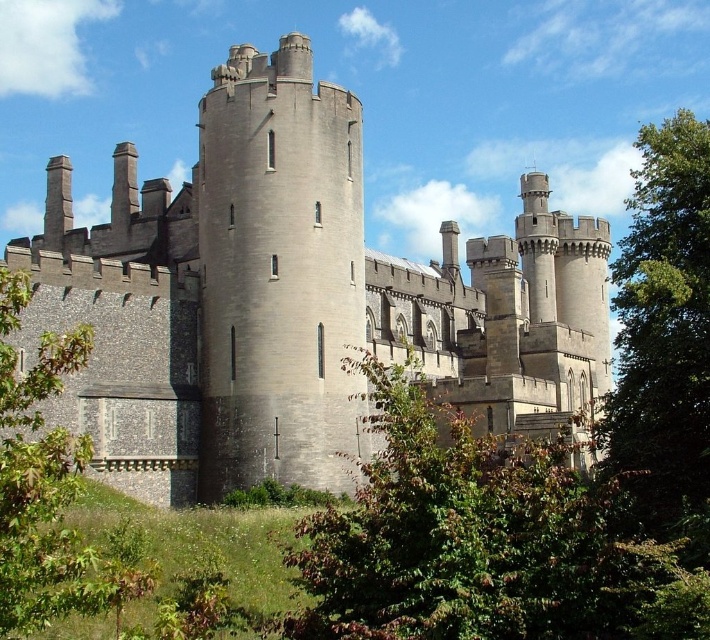
Between gray stone tower at center and green leafy tree at right, which one has more height?

With more height is green leafy tree at right.

Who is lower down, gray stone tower at center or green leafy tree at right?

Positioned lower is gray stone tower at center.

Is point (278, 99) behind point (662, 227)?

Yes, it is.

At what (x,y) coordinates should I click in order to perform the action: click on gray stone tower at center. Please return your answer as a coordinate pair (x, y). Image resolution: width=710 pixels, height=640 pixels. Looking at the image, I should click on (278, 272).

Which is below, gray stone castle at center or gray stone tower at center?

gray stone castle at center is lower down.

Which is more to the right, gray stone castle at center or gray stone tower at center?

gray stone castle at center is more to the right.

Does point (244, 291) come behind point (263, 260)?

No, it is in front of (263, 260).

I want to click on gray stone castle at center, so click(x=295, y=300).

The height and width of the screenshot is (640, 710). Describe the element at coordinates (295, 300) in the screenshot. I see `gray stone castle at center` at that location.

I want to click on gray stone castle at center, so click(x=295, y=300).

What do you see at coordinates (295, 300) in the screenshot?
I see `gray stone castle at center` at bounding box center [295, 300].

What are the coordinates of `gray stone castle at center` in the screenshot? It's located at (295, 300).